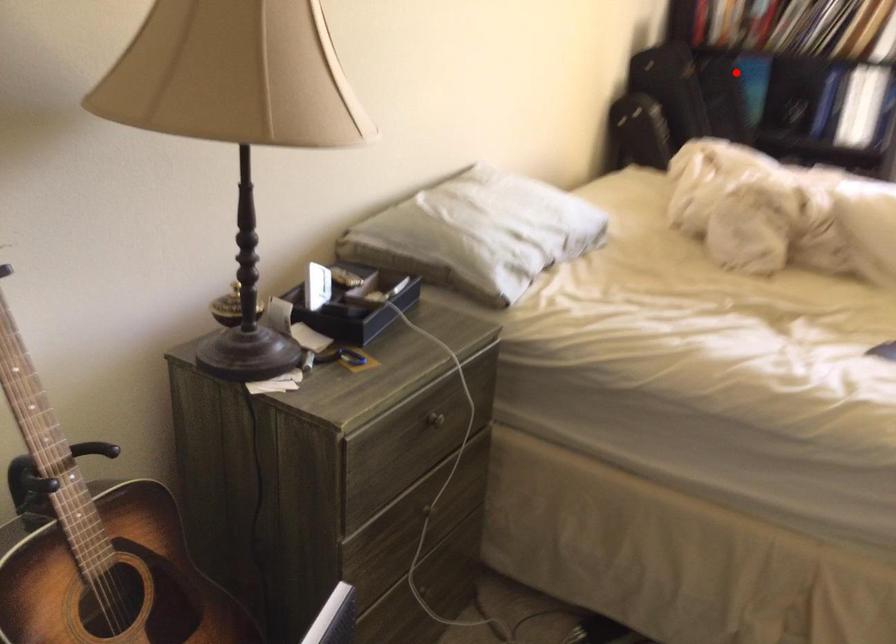
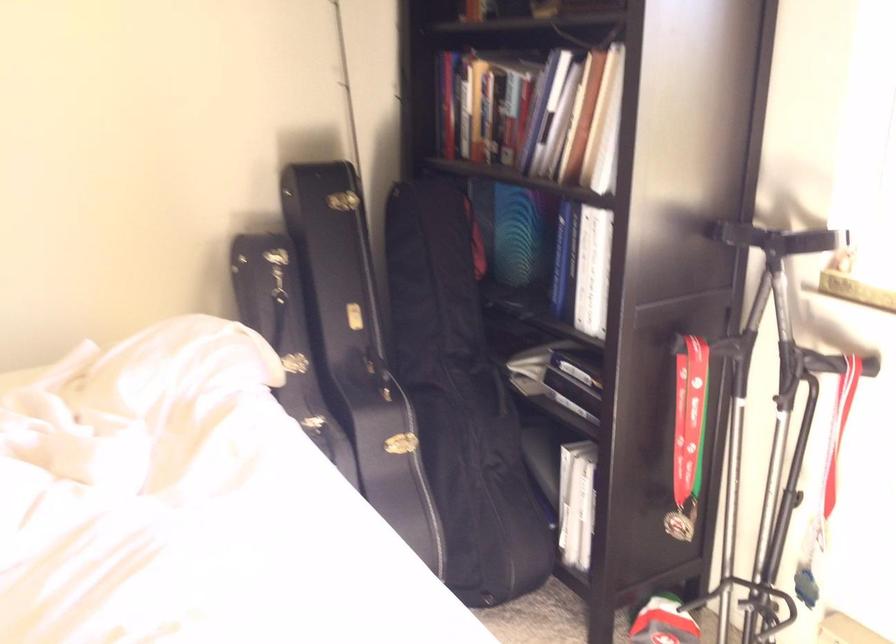
Question: A red point is marked in image1. In image2, is the corresponding 3D point closer to the camera or farther? Reply with the corresponding letter.

Choices:
 (A) The corresponding 3D point is closer.
 (B) The corresponding 3D point is farther.

Answer: (A)